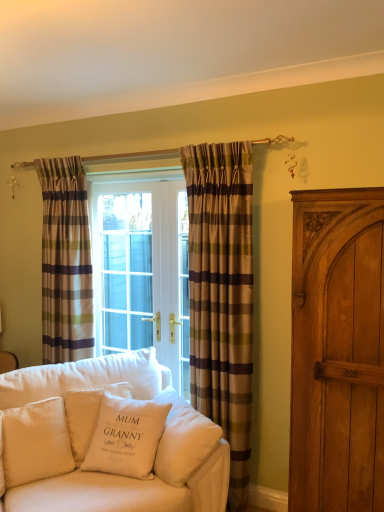
Identify the location of plaid fabric curtain at center, acting as the 1th curtain starting from the right. Image resolution: width=384 pixels, height=512 pixels. (222, 296).

The width and height of the screenshot is (384, 512). In order to click on wooden carved cabinet at right in this screenshot , I will do `click(337, 351)`.

In order to face velvet white couch at center, should I rotate leftwards or rightwards?

You should look left and rotate roughly 10.968 degrees.

What do you see at coordinates (126, 437) in the screenshot? Image resolution: width=384 pixels, height=512 pixels. I see `white cotton pillow at center, the 3th pillow in the left-to-right sequence` at bounding box center [126, 437].

Where is `white cotton pillow at center, positioned as the second pillow in left-to-right order`? This screenshot has height=512, width=384. white cotton pillow at center, positioned as the second pillow in left-to-right order is located at coordinates [x=87, y=415].

The image size is (384, 512). What do you see at coordinates (65, 262) in the screenshot? I see `plaid fabric curtain at left, the second curtain from the right` at bounding box center [65, 262].

At what (x,y) coordinates should I click in order to perform the action: click on plaid fabric curtain at left, marked as the 1th curtain in a back-to-front arrangement. Please return your answer as a coordinate pair (x, y). Looking at the image, I should click on (65, 262).

The width and height of the screenshot is (384, 512). Describe the element at coordinates (183, 440) in the screenshot. I see `white soft cushion at lower left, the 4th pillow viewed from the left` at that location.

You are a GUI agent. You are given a task and a screenshot of the screen. Output one action in this format:
    pyautogui.click(x=<x>, y=<y>)
    Task: Click on the plaid fabric curtain at center, placed as the second curtain when sorted from back to front
    
    Given the screenshot: What is the action you would take?
    pyautogui.click(x=222, y=296)

There is a wooden carved cabinet at right. Where is `the 1st pillow below it (from a real-world perspective)`? Image resolution: width=384 pixels, height=512 pixels. the 1st pillow below it (from a real-world perspective) is located at coordinates (87, 415).

Which is more to the right, white cotton pillow at center, positioned as the second pillow in left-to-right order, or wooden carved cabinet at right?

wooden carved cabinet at right.

Is white cotton pillow at center, positioned as the second pillow in left-to-right order, in contact with wooden carved cabinet at right?

white cotton pillow at center, positioned as the second pillow in left-to-right order, and wooden carved cabinet at right are not in contact.

Is white cotton pillow at center, positioned as the second pillow in left-to-right order, looking in the opposite direction of wooden carved cabinet at right?

No, white cotton pillow at center, positioned as the second pillow in left-to-right order, is not facing the opposite direction of wooden carved cabinet at right.

Considering the sizes of objects white cotton pillow at center, which is counted as the third pillow, starting from the right, and plaid fabric curtain at center, the first curtain positioned from the front, in the image provided, who is thinner, white cotton pillow at center, which is counted as the third pillow, starting from the right, or plaid fabric curtain at center, the first curtain positioned from the front,?

With smaller width is plaid fabric curtain at center, the first curtain positioned from the front.

In terms of size, does white cotton pillow at center, which is counted as the third pillow, starting from the right, appear bigger or smaller than plaid fabric curtain at center, placed as the second curtain when sorted from back to front?

white cotton pillow at center, which is counted as the third pillow, starting from the right, is smaller than plaid fabric curtain at center, placed as the second curtain when sorted from back to front.

Is point (125, 391) farther from viewer compared to point (225, 381)?

No.

From a real-world perspective, count 1st curtains upward from the white cotton pillow at center, positioned as the second pillow in left-to-right order, and point to it. Please provide its 2D coordinates.

[(222, 296)]

From a real-world perspective, does white soft cushion at lower left, which appears as the 1th pillow when viewed from the right, stand above wooden carved cabinet at right?

Incorrect, from a real-world perspective, white soft cushion at lower left, which appears as the 1th pillow when viewed from the right, is lower than wooden carved cabinet at right.

Is white soft cushion at lower left, the 4th pillow viewed from the left, spatially inside wooden carved cabinet at right, or outside of it?

white soft cushion at lower left, the 4th pillow viewed from the left, is not enclosed by wooden carved cabinet at right.

Is white soft cushion at lower left, the 4th pillow viewed from the left, next to wooden carved cabinet at right?

No, white soft cushion at lower left, the 4th pillow viewed from the left, is not next to wooden carved cabinet at right.

From the image's perspective, which object appears higher, white soft cushion at lower left, which appears as the 1th pillow when viewed from the right, or wooden carved cabinet at right?

wooden carved cabinet at right appears higher in the image.

Who is smaller, wooden carved cabinet at right or white quilted pillow at lower left, marked as the 1th pillow in a left-to-right arrangement?

white quilted pillow at lower left, marked as the 1th pillow in a left-to-right arrangement.

Are wooden carved cabinet at right and white quilted pillow at lower left, marked as the 1th pillow in a left-to-right arrangement, making contact?

They are not placed beside each other.

Is point (357, 405) less distant than point (22, 430)?

Yes, point (357, 405) is in front of point (22, 430).

Considering the relative sizes of velvet white couch at center and plaid fabric curtain at left, the first curtain when ordered from left to right, in the image provided, is velvet white couch at center bigger than plaid fabric curtain at left, the first curtain when ordered from left to right,?

Indeed, velvet white couch at center has a larger size compared to plaid fabric curtain at left, the first curtain when ordered from left to right.

Could you tell me if velvet white couch at center is turned towards plaid fabric curtain at left, the second curtain when ordered from front to back?

No, velvet white couch at center is not facing towards plaid fabric curtain at left, the second curtain when ordered from front to back.

Is velvet white couch at center far from plaid fabric curtain at left, the second curtain when ordered from front to back?

No, there isn't a large distance between velvet white couch at center and plaid fabric curtain at left, the second curtain when ordered from front to back.

From a real-world perspective, is velvet white couch at center located higher than plaid fabric curtain at left, the second curtain when ordered from front to back?

No, from a real-world perspective, velvet white couch at center is not on top of plaid fabric curtain at left, the second curtain when ordered from front to back.

From the image's perspective, does plaid fabric curtain at center, which is the second curtain from left to right, appear higher than velvet white couch at center?

Yes.

Consider the image. Considering the sizes of objects plaid fabric curtain at center, which is the second curtain from left to right, and velvet white couch at center in the image provided, who is smaller, plaid fabric curtain at center, which is the second curtain from left to right, or velvet white couch at center?

plaid fabric curtain at center, which is the second curtain from left to right.

Is velvet white couch at center inside plaid fabric curtain at center, placed as the second curtain when sorted from back to front?

No, velvet white couch at center is located outside of plaid fabric curtain at center, placed as the second curtain when sorted from back to front.

From a real-world perspective, who is located higher, white cotton pillow at center, acting as the second pillow starting from the right, or white soft cushion at lower left, the 4th pillow viewed from the left?

white cotton pillow at center, acting as the second pillow starting from the right.

Is white cotton pillow at center, the 3th pillow in the left-to-right sequence, directly adjacent to white soft cushion at lower left, the 4th pillow viewed from the left?

white cotton pillow at center, the 3th pillow in the left-to-right sequence, and white soft cushion at lower left, the 4th pillow viewed from the left, are clearly separated.

Is white cotton pillow at center, acting as the second pillow starting from the right, aimed at white soft cushion at lower left, which appears as the 1th pillow when viewed from the right?

No, white cotton pillow at center, acting as the second pillow starting from the right, is not oriented towards white soft cushion at lower left, which appears as the 1th pillow when viewed from the right.

Is white cotton pillow at center, acting as the second pillow starting from the right, smaller than white soft cushion at lower left, the 4th pillow viewed from the left?

Indeed, white cotton pillow at center, acting as the second pillow starting from the right, has a smaller size compared to white soft cushion at lower left, the 4th pillow viewed from the left.

Where is `barn door in front of the white cotton pillow at center, positioned as the second pillow in left-to-right order`? The image size is (384, 512). barn door in front of the white cotton pillow at center, positioned as the second pillow in left-to-right order is located at coordinates (337, 351).

From a real-world perspective, starting from the plaid fabric curtain at center, acting as the 1th curtain starting from the right, which pillow is the 1st one below it? Please provide its 2D coordinates.

[(87, 415)]

Based on their spatial positions, is white cotton pillow at center, positioned as the second pillow in left-to-right order, or white cotton pillow at center, the 3th pillow in the left-to-right sequence, further from wooden carved cabinet at right?

The object further to wooden carved cabinet at right is white cotton pillow at center, positioned as the second pillow in left-to-right order.

From the image, which object appears to be nearer to plaid fabric curtain at center, the first curtain positioned from the front, white soft cushion at lower left, which appears as the 1th pillow when viewed from the right, or white quilted pillow at lower left, the fourth pillow when ordered from right to left?

white soft cushion at lower left, which appears as the 1th pillow when viewed from the right, is closer to plaid fabric curtain at center, the first curtain positioned from the front.

Which object lies further to the anchor point white soft cushion at lower left, which appears as the 1th pillow when viewed from the right, white cotton pillow at center, acting as the second pillow starting from the right, or velvet white couch at center?

Among the two, velvet white couch at center is located further to white soft cushion at lower left, which appears as the 1th pillow when viewed from the right.

Considering their positions, is plaid fabric curtain at left, marked as the 1th curtain in a back-to-front arrangement, positioned closer to white soft cushion at lower left, the 4th pillow viewed from the left, than white quilted pillow at lower left, marked as the 1th pillow in a left-to-right arrangement?

Among the two, white quilted pillow at lower left, marked as the 1th pillow in a left-to-right arrangement, is located nearer to white soft cushion at lower left, the 4th pillow viewed from the left.

In the scene shown: Considering their positions, is plaid fabric curtain at left, the second curtain when ordered from front to back, positioned further to white cotton pillow at center, positioned as the second pillow in left-to-right order, than white soft cushion at lower left, the 4th pillow viewed from the left?

plaid fabric curtain at left, the second curtain when ordered from front to back, lies further to white cotton pillow at center, positioned as the second pillow in left-to-right order, than the other object.

From the image, which object appears to be nearer to white cotton pillow at center, acting as the second pillow starting from the right, white quilted pillow at lower left, marked as the 1th pillow in a left-to-right arrangement, or plaid fabric curtain at left, the first curtain when ordered from left to right?

Among the two, white quilted pillow at lower left, marked as the 1th pillow in a left-to-right arrangement, is located nearer to white cotton pillow at center, acting as the second pillow starting from the right.

Considering their positions, is wooden carved cabinet at right positioned closer to white quilted pillow at lower left, marked as the 1th pillow in a left-to-right arrangement, than plaid fabric curtain at center, which is the second curtain from left to right?

plaid fabric curtain at center, which is the second curtain from left to right.

Based on their spatial positions, is white soft cushion at lower left, which appears as the 1th pillow when viewed from the right, or wooden carved cabinet at right closer to white quilted pillow at lower left, marked as the 1th pillow in a left-to-right arrangement?

Among the two, white soft cushion at lower left, which appears as the 1th pillow when viewed from the right, is located nearer to white quilted pillow at lower left, marked as the 1th pillow in a left-to-right arrangement.

Where is `pillow that lies between plaid fabric curtain at left, the first curtain when ordered from left to right, and white cotton pillow at center, acting as the second pillow starting from the right, from top to bottom`? Image resolution: width=384 pixels, height=512 pixels. pillow that lies between plaid fabric curtain at left, the first curtain when ordered from left to right, and white cotton pillow at center, acting as the second pillow starting from the right, from top to bottom is located at coordinates (87, 415).

Find the location of a particular element. studio couch between white quilted pillow at lower left, the fourth pillow when ordered from right to left, and white soft cushion at lower left, which appears as the 1th pillow when viewed from the right, in the horizontal direction is located at coordinates (105, 439).

What are the coordinates of `curtain between white quilted pillow at lower left, the fourth pillow when ordered from right to left, and wooden carved cabinet at right from left to right` in the screenshot? It's located at (x=222, y=296).

At what (x,y) coordinates should I click in order to perform the action: click on studio couch between white cotton pillow at center, positioned as the second pillow in left-to-right order, and wooden carved cabinet at right. Please return your answer as a coordinate pair (x, y). Looking at the image, I should click on (105, 439).